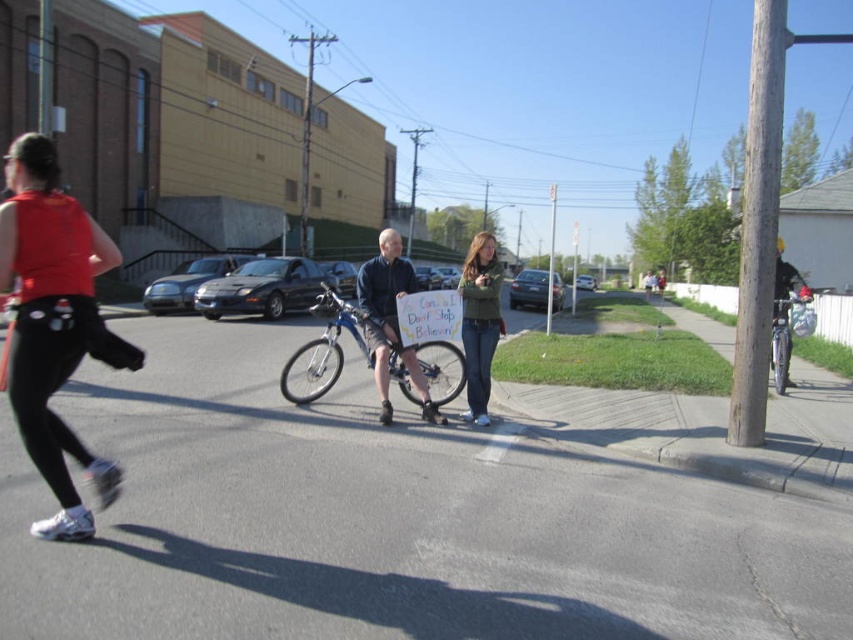
From the picture: Is matte red tank top at left positioned at the back of green fuzzy sweater at center?

No.

Can you confirm if matte red tank top at left is positioned to the left of green fuzzy sweater at center?

Yes, matte red tank top at left is to the left of green fuzzy sweater at center.

Measure the distance between point (35, 193) and camera.

Point (35, 193) and camera are 12.50 feet apart.

The width and height of the screenshot is (853, 640). Identify the location of matte red tank top at left. (55, 324).

Is point (439, 372) less distant than point (805, 285)?

Yes, it is in front of point (805, 285).

Is blue metallic bicycle at center shorter than metallic silver bicycle at right?

No, blue metallic bicycle at center is not shorter than metallic silver bicycle at right.

Does point (343, 356) come farther from viewer compared to point (778, 358)?

Yes, it is behind point (778, 358).

Locate an element on the screen. The width and height of the screenshot is (853, 640). blue metallic bicycle at center is located at coordinates (326, 346).

Is point (73, 307) closer to viewer compared to point (379, 387)?

Yes, it is.

Who is shorter, matte red tank top at left or blue denim shorts at center?

matte red tank top at left

Describe the element at coordinates (55, 324) in the screenshot. The width and height of the screenshot is (853, 640). I see `matte red tank top at left` at that location.

You are a GUI agent. You are given a task and a screenshot of the screen. Output one action in this format:
    pyautogui.click(x=<x>, y=<y>)
    Task: Click on the matte red tank top at left
    
    Given the screenshot: What is the action you would take?
    pyautogui.click(x=55, y=324)